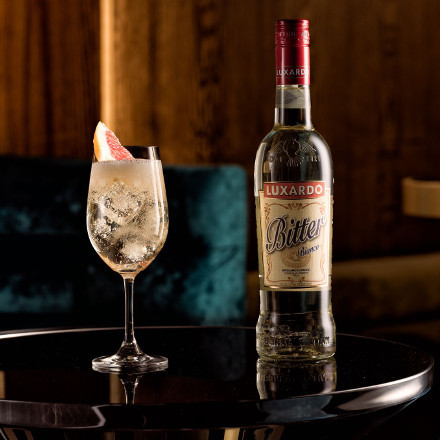
The height and width of the screenshot is (440, 440). Find the location of `glass table top`. glass table top is located at coordinates (203, 375).